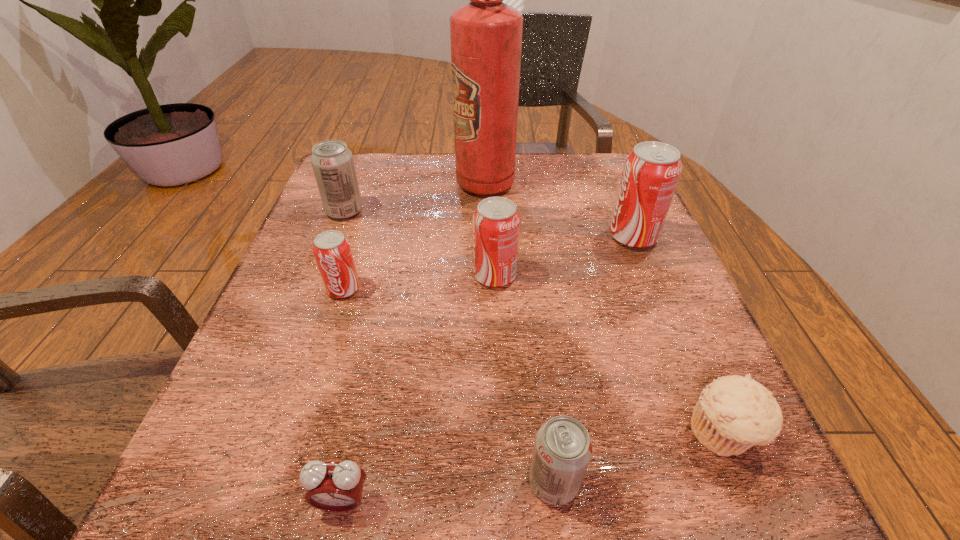
At what (x,y) coordinates should I click in order to perform the action: click on vacant space located on the logo side of the second biggest red soda can. Please return your answer as a coordinate pair (x, y). The height and width of the screenshot is (540, 960). Looking at the image, I should click on coord(289,276).

Where is `vacant space located 0.260m on the logo side of the second biggest red soda can`? The image size is (960, 540). vacant space located 0.260m on the logo side of the second biggest red soda can is located at coordinates (336, 276).

Locate an element on the screen. vacant area situated 0.050m on the logo side of the second biggest red soda can is located at coordinates (447, 276).

Identify the location of free space located on the logo side of the leftmost red soda can. [x=313, y=382].

Where is `free region located on the left of the nearest soda can`? The width and height of the screenshot is (960, 540). free region located on the left of the nearest soda can is located at coordinates (347, 482).

Locate an element on the screen. This screenshot has width=960, height=540. vacant space located 0.200m on the back of the beige muffin is located at coordinates (667, 303).

Identify the location of fire extinguisher that is at the far edge. This screenshot has width=960, height=540. (486, 34).

The image size is (960, 540). In order to click on soda can at the far edge in this screenshot , I will do `click(332, 162)`.

The width and height of the screenshot is (960, 540). I want to click on soda can that is at the near edge, so click(x=563, y=448).

This screenshot has height=540, width=960. I want to click on alarm clock that is at the near edge, so click(333, 486).